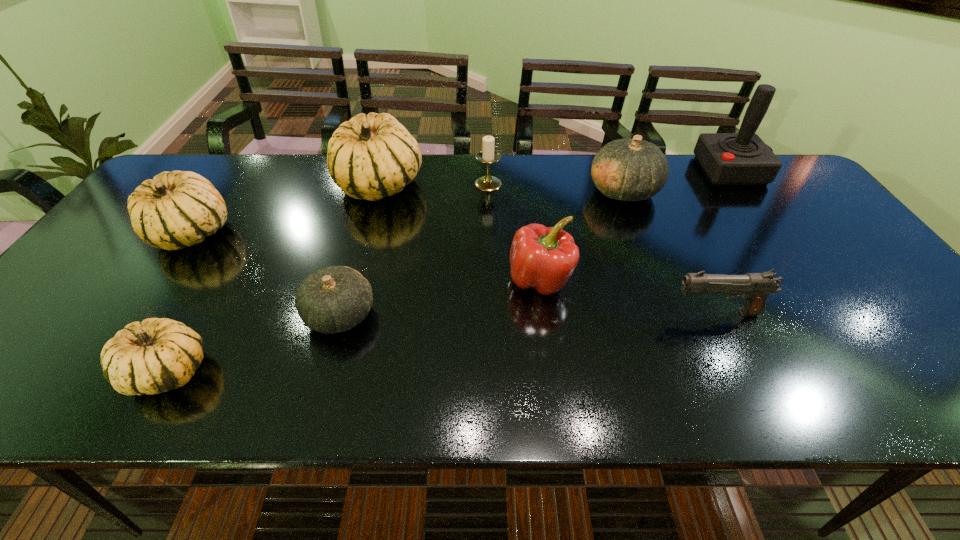
The height and width of the screenshot is (540, 960). In order to click on free space between the gun and the fourth object from right to left in this screenshot , I will do `click(628, 296)`.

You are a GUI agent. You are given a task and a screenshot of the screen. Output one action in this format:
    pyautogui.click(x=<x>, y=<y>)
    Task: Click on the empty location between the fifth object from left to right and the right orange gourd
    The width and height of the screenshot is (960, 540).
    Given the screenshot: What is the action you would take?
    pyautogui.click(x=556, y=187)

At what (x,y) coordinates should I click in order to perform the action: click on free point between the smallest white gourd and the red joystick. Please return your answer as a coordinate pair (x, y). The image size is (960, 540). Looking at the image, I should click on (449, 271).

Locate an element on the screen. This screenshot has height=540, width=960. vacant region between the fifth object from right to left and the gray gun is located at coordinates (602, 248).

Find the location of a particular element. The height and width of the screenshot is (540, 960). vacant area that lies between the second biggest white gourd and the smaller orange gourd is located at coordinates (267, 274).

The image size is (960, 540). In order to click on unoccupied area between the second smallest white gourd and the nearer orange gourd in this screenshot , I will do click(x=267, y=274).

Locate an element on the screen. Image resolution: width=960 pixels, height=540 pixels. free space between the smaller orange gourd and the tallest gourd is located at coordinates (360, 250).

Locate an element on the screen. object that is the second closest to the smallest white gourd is located at coordinates (176, 209).

Select which object appears as the eighth closest to the pepper. Please provide its 2D coordinates. Your answer should be formatted as a tuple, i.e. [(x, y)], where the tuple contains the x and y coordinates of a point satisfying the conditions above.

[(176, 209)]

Identify the location of gourd that is the closest to the second biggest white gourd. This screenshot has width=960, height=540. (373, 156).